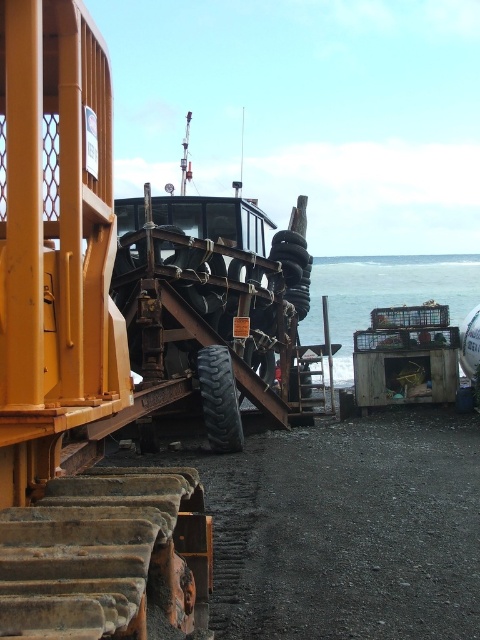
You are a delivery person who needs to place a new tire onto the black rubber tire at center. Given that the blue water at lower right is nearby, should you be cautious about placing the tire too close to it?

The blue water at lower right is larger in size than the black rubber tire at center. Since the water is bigger, there might be enough space, but you should still be cautious as water surfaces can be unstable and might cause the tire to shift or float.

You are standing at the center of the image and want to reach the blue water at lower right. According to the coordinates provided, in which direction should you move from your current position?

The blue water at lower right is located at coordinates point (x=384, y=292). Since you are at the center, you should move towards the lower right direction to reach the blue water at lower right.

You are standing on the wooden dock and want to jump into the water. Which object, the blue water at lower right or the black rubber tire at center, is higher from your current position?

The blue water at lower right has a greater height compared to the black rubber tire at center, so the blue water at lower right is higher from your current position on the wooden dock.